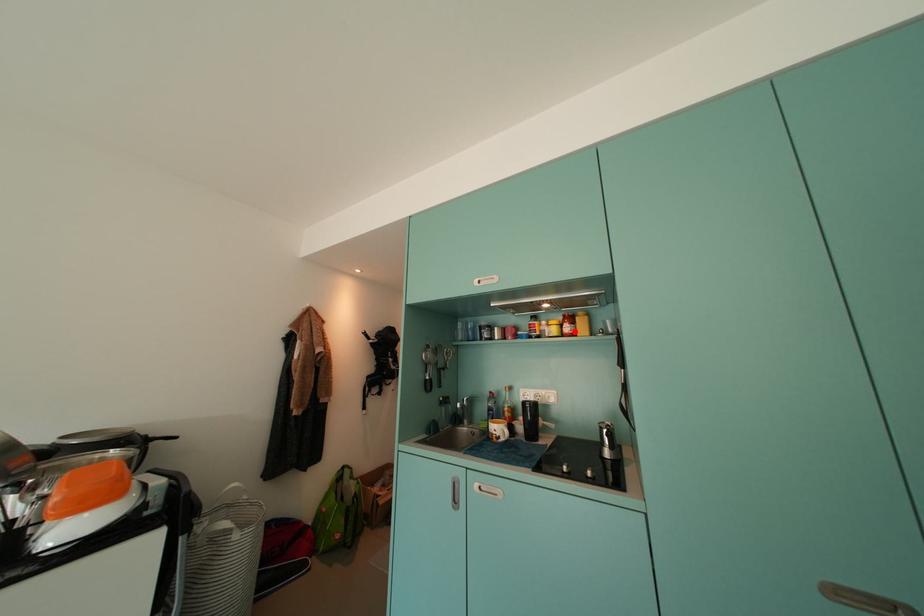
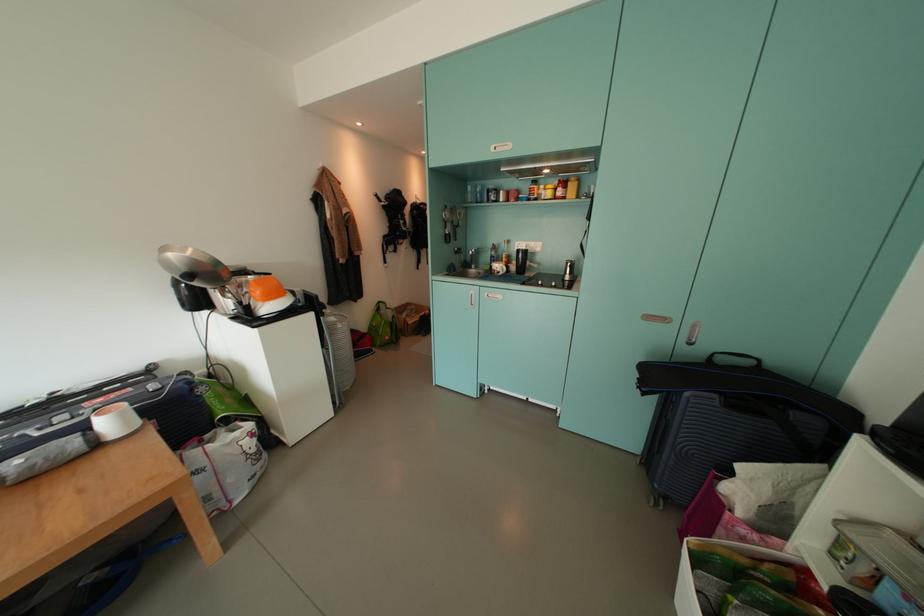
Question: I am providing you with two images of the same scene from different viewpoints. Image1 has a red point marked. In image2, the corresponding 3D location appears at what relative position? Reply with the corresponding letter.

Choices:
 (A) Closer
 (B) Farther

Answer: (A)